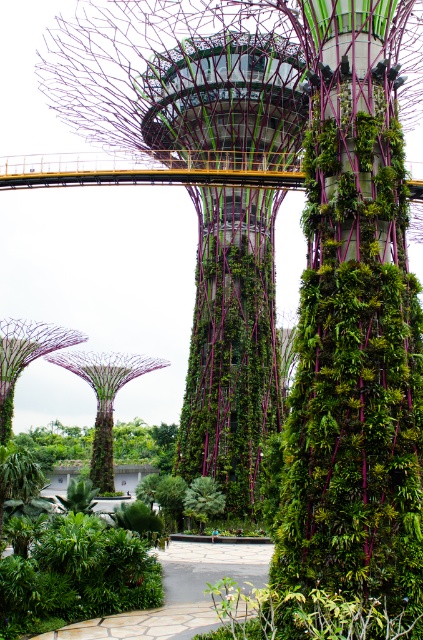
Question: Among these objects, which one is nearest to the camera?

Choices:
 (A) green leafy tree at lower left
 (B) green leafy tree at center
 (C) green textured tower at center

Answer: (B)

Question: Is green leafy tree at lower left to the left of green leafy tree at center from the viewer's perspective?

Choices:
 (A) yes
 (B) no

Answer: (A)

Question: Can you confirm if green textured tower at center is positioned above green leafy tree at center?

Choices:
 (A) yes
 (B) no

Answer: (A)

Question: Estimate the real-world distances between objects in this image. Which object is closer to the green textured tower at center?

Choices:
 (A) green leafy tree at center
 (B) green leafy tree at lower left

Answer: (A)

Question: From the image, what is the correct spatial relationship of green textured tower at center in relation to green leafy tree at center?

Choices:
 (A) above
 (B) below

Answer: (A)

Question: Which object is positioned closest to the green leafy tree at center?

Choices:
 (A) green leafy tree at lower left
 (B) green textured tower at center

Answer: (B)